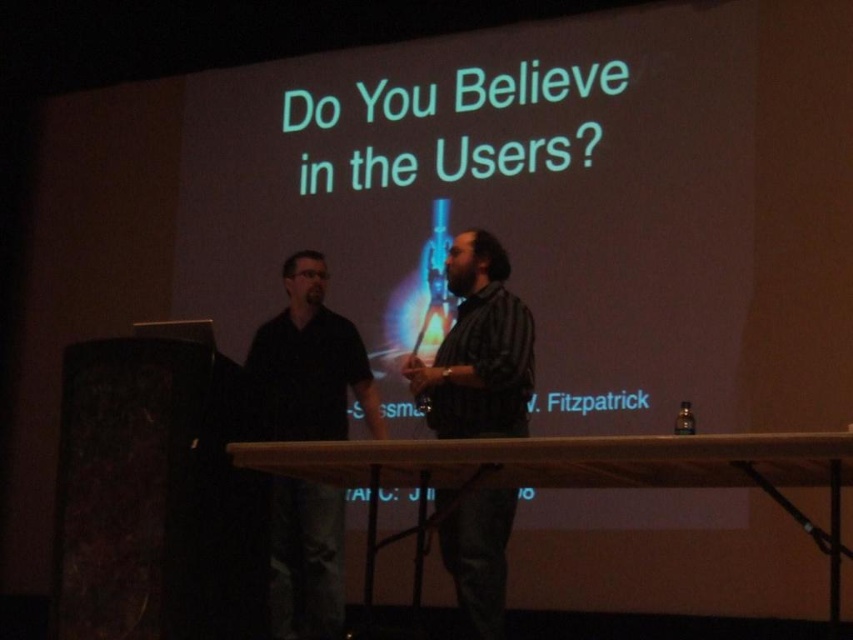
Which of these two, black matte shirt at left or striped cotton shirt at center, stands taller?

striped cotton shirt at center is taller.

Find the location of a particular element. Image resolution: width=853 pixels, height=640 pixels. black matte shirt at left is located at coordinates (309, 364).

Does point (634, 392) come behind point (306, 627)?

Yes, point (634, 392) is behind point (306, 627).

Does white matte projection screen at upper center lie in front of black matte shirt at left?

Yes, it is in front of black matte shirt at left.

Where is `white matte projection screen at upper center`? The image size is (853, 640). white matte projection screen at upper center is located at coordinates (498, 200).

Where is `white matte projection screen at upper center`? white matte projection screen at upper center is located at coordinates (498, 200).

Based on the photo, can you confirm if white matte projection screen at upper center is positioned to the left of striped cotton shirt at center?

Correct, you'll find white matte projection screen at upper center to the left of striped cotton shirt at center.

Does white matte projection screen at upper center appear over striped cotton shirt at center?

Yes, white matte projection screen at upper center is above striped cotton shirt at center.

The width and height of the screenshot is (853, 640). In order to click on white matte projection screen at upper center in this screenshot , I will do `click(498, 200)`.